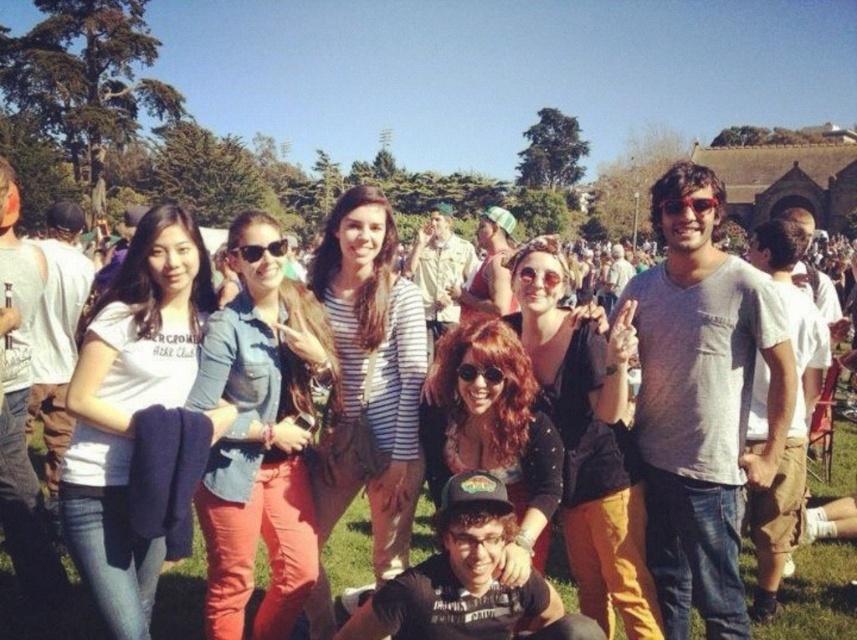
You are a photographer trying to focus on the matte black sunglasses at center. However, the striped shirt at center is blocking your view. Can you adjust your position to see the sunglasses without moving the subjects?

The striped shirt at center is further to the viewer than matte black sunglasses at center, so moving your camera position slightly backward might allow you to see the matte black sunglasses at center without obstruction.